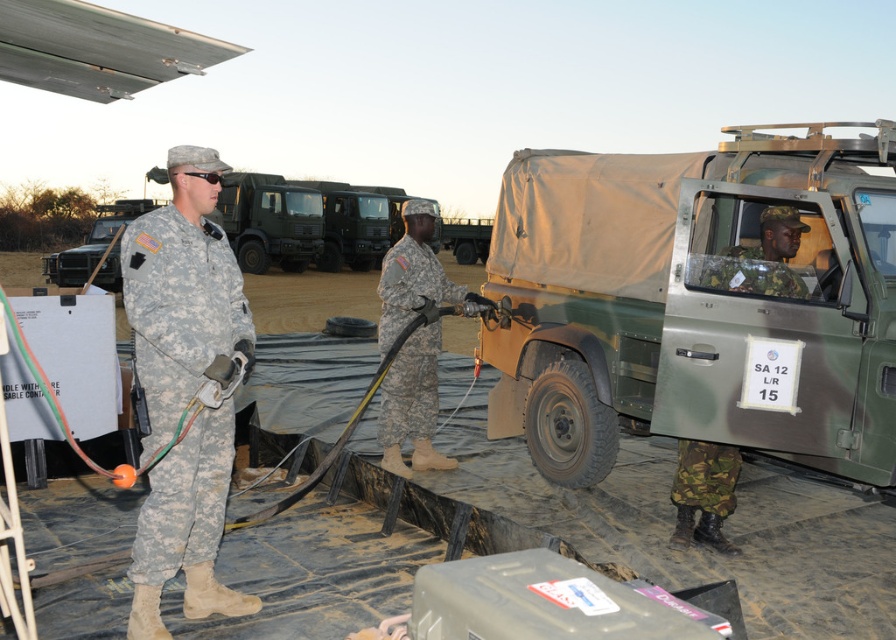
You are a military planner trying to assess the spatial arrangement of the scene. Given the green matte truck at center and the camouflage fabric uniform at right, which object occupies more space in the image?

The green matte truck at center is larger in size than the camouflage fabric uniform at right, so it occupies more space in the image.

You are a military planner observing the scene. You need to position a new equipment box between the green matte truck at center and the camouflage fabric uniform at right. Based on their positions, which object should the box be placed closer to?

The green matte truck at center is above the camouflage fabric uniform at right, so the equipment box should be placed closer to the camouflage fabric uniform at right to maintain vertical alignment.

You are a military observer positioned at the back of the scene. You see two personnel in camouflage fabric uniform at left and camouflage fabric uniform at right. Which one is closer to you?

The camouflage fabric uniform at left is closer to you because it is in front of the camouflage fabric uniform at right.